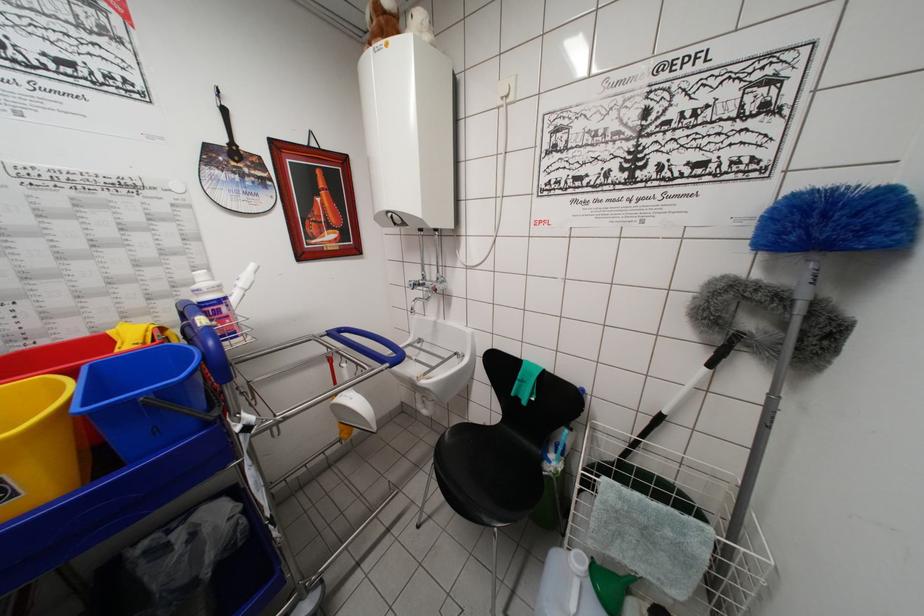
The image size is (924, 616). What do you see at coordinates (672, 519) in the screenshot?
I see `the white wire basket` at bounding box center [672, 519].